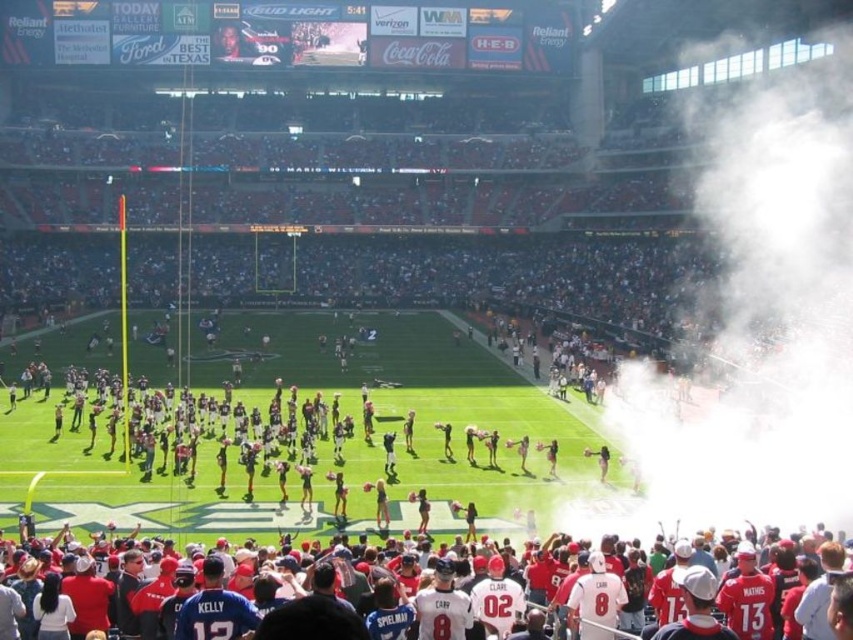
Question: Which point is farther to the camera?

Choices:
 (A) red jersey fans at lower center
 (B) white fog at right

Answer: (B)

Question: Is white fog at right above red jersey fans at lower center?

Choices:
 (A) yes
 (B) no

Answer: (A)

Question: Which object is farther from the camera taking this photo?

Choices:
 (A) red jersey fans at lower center
 (B) white fog at right

Answer: (B)

Question: Is white fog at right above red jersey fans at lower center?

Choices:
 (A) no
 (B) yes

Answer: (B)

Question: Can you confirm if white fog at right is thinner than red jersey fans at lower center?

Choices:
 (A) no
 (B) yes

Answer: (A)